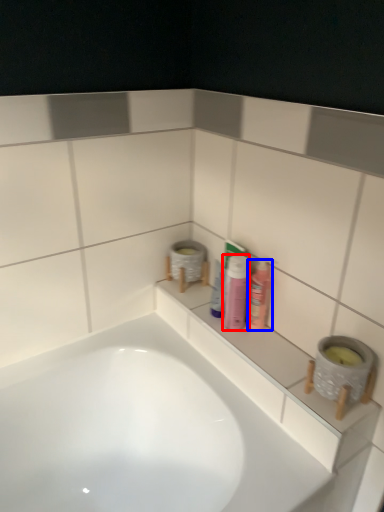
Question: Which object appears farthest to the camera in this image, toiletry (highlighted by a red box) or mouthwash (highlighted by a blue box)?

Choices:
 (A) toiletry
 (B) mouthwash

Answer: (B)